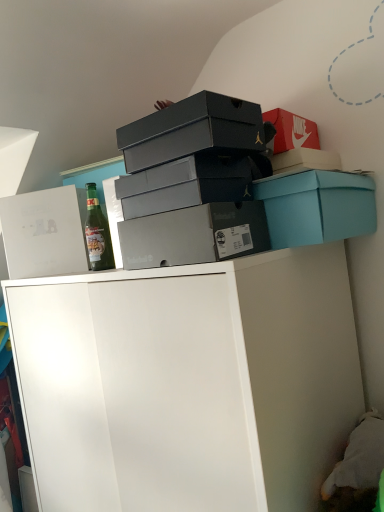
Question: Can you confirm if white matte cabinet at upper center is positioned to the left of matte gray shoebox at center, placed as the 2th box when sorted from right to left?

Choices:
 (A) yes
 (B) no

Answer: (A)

Question: Is white matte cabinet at upper center at the right side of matte gray shoebox at center, which appears as the 4th box when viewed from the left?

Choices:
 (A) no
 (B) yes

Answer: (A)

Question: Considering the relative sizes of white matte cabinet at upper center and matte gray shoebox at center, which appears as the 4th box when viewed from the left, in the image provided, is white matte cabinet at upper center thinner than matte gray shoebox at center, which appears as the 4th box when viewed from the left,?

Choices:
 (A) no
 (B) yes

Answer: (A)

Question: Is matte gray shoebox at center, which appears as the 4th box when viewed from the left, a part of white matte cabinet at upper center?

Choices:
 (A) yes
 (B) no

Answer: (B)

Question: Does white matte cabinet at upper center have a lesser height compared to matte gray shoebox at center, which appears as the 4th box when viewed from the left?

Choices:
 (A) yes
 (B) no

Answer: (B)

Question: From a real-world perspective, is white matte cabinet at upper center below matte gray shoebox at center, placed as the 2th box when sorted from right to left?

Choices:
 (A) yes
 (B) no

Answer: (A)

Question: Is matte gray shoebox at center, which appears as the 4th box when viewed from the left, far from white cardboard box at upper left, marked as the 1th box in a left-to-right arrangement?

Choices:
 (A) yes
 (B) no

Answer: (B)

Question: From a real-world perspective, is matte gray shoebox at center, which appears as the 4th box when viewed from the left, below white cardboard box at upper left, marked as the 1th box in a left-to-right arrangement?

Choices:
 (A) yes
 (B) no

Answer: (A)

Question: From the image's perspective, is matte gray shoebox at center, placed as the 2th box when sorted from right to left, beneath white cardboard box at upper left, the fifth box positioned from the right?

Choices:
 (A) yes
 (B) no

Answer: (A)

Question: Can you confirm if matte gray shoebox at center, placed as the 2th box when sorted from right to left, is wider than white cardboard box at upper left, the fifth box positioned from the right?

Choices:
 (A) no
 (B) yes

Answer: (A)

Question: Can you confirm if matte gray shoebox at center, which appears as the 4th box when viewed from the left, is shorter than white cardboard box at upper left, marked as the 1th box in a left-to-right arrangement?

Choices:
 (A) no
 (B) yes

Answer: (B)

Question: Is matte gray shoebox at center, which appears as the 4th box when viewed from the left, beside white cardboard box at upper left, marked as the 1th box in a left-to-right arrangement?

Choices:
 (A) no
 (B) yes

Answer: (A)

Question: From a real-world perspective, is matte black shoebox at upper center, the second box when ordered from left to right, located beneath teal cardboard box at upper right, arranged as the 1th box when viewed from the right?

Choices:
 (A) yes
 (B) no

Answer: (B)